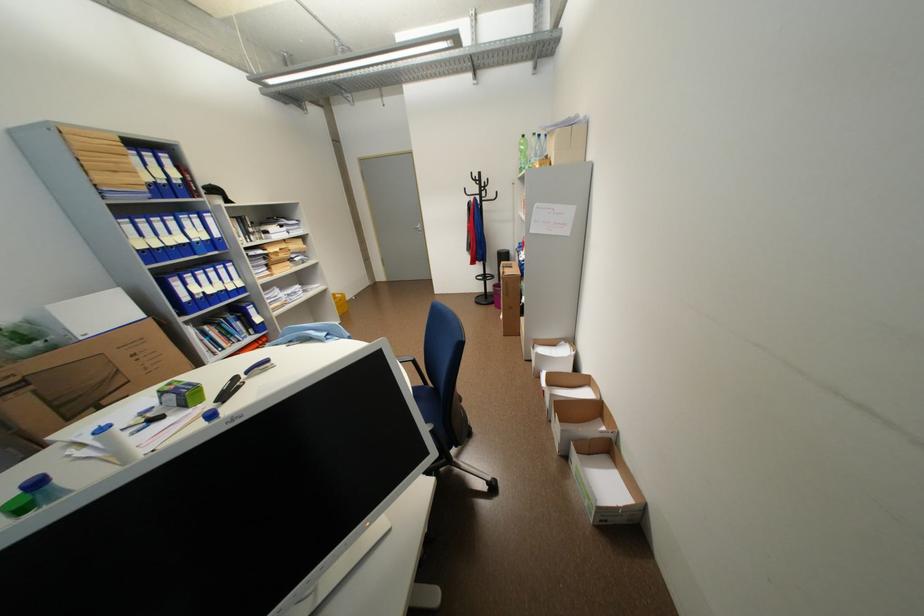
Find where to press the black stapler. Please return your answer as a coordinate pair (x, y).

(228, 390)